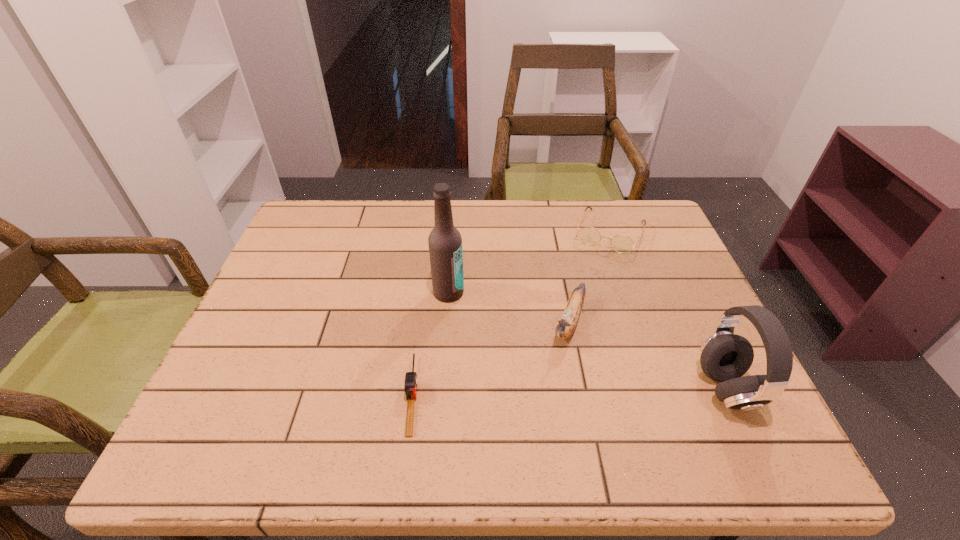
Where is `free area in between the shortest object and the farthest object`? free area in between the shortest object and the farthest object is located at coordinates (511, 313).

Locate an element on the screen. free space that is in between the tallest object and the headset is located at coordinates (588, 341).

Select which object is the third closest to the banana. Please provide its 2D coordinates. Your answer should be formatted as a tuple, i.e. [(x, y)], where the tuple contains the x and y coordinates of a point satisfying the conditions above.

[(445, 243)]

Select which object appears as the third closest to the banana. Please provide its 2D coordinates. Your answer should be formatted as a tuple, i.e. [(x, y)], where the tuple contains the x and y coordinates of a point satisfying the conditions above.

[(445, 243)]

This screenshot has width=960, height=540. Identify the location of vacant space that satisfies the following two spatial constraints: 1. on the front side of the tallest object; 2. on the ear cups of the fourth shortest object. click(442, 389).

Find the location of a particular element. The image size is (960, 540). vacant position in the image that satisfies the following two spatial constraints: 1. on the front side of the headset; 2. on the ear cups of the fourth object from right to left is located at coordinates (442, 389).

The width and height of the screenshot is (960, 540). What are the coordinates of `vacant area in the image that satisfies the following two spatial constraints: 1. on the front side of the fourth shortest object; 2. on the ear cups of the third object from left to right` in the screenshot? It's located at (581, 389).

Where is `vacant position in the image that satisfies the following two spatial constraints: 1. on the back side of the third tallest object; 2. on the right side of the spectacles`? This screenshot has width=960, height=540. vacant position in the image that satisfies the following two spatial constraints: 1. on the back side of the third tallest object; 2. on the right side of the spectacles is located at coordinates (550, 231).

Where is `vacant region that satisfies the following two spatial constraints: 1. on the back side of the third object from left to right; 2. on the left side of the tape measure`? Image resolution: width=960 pixels, height=540 pixels. vacant region that satisfies the following two spatial constraints: 1. on the back side of the third object from left to right; 2. on the left side of the tape measure is located at coordinates (421, 322).